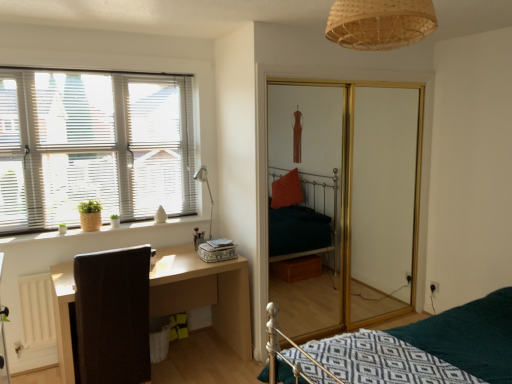
Question: Considering the relative positions of brown leather swivel chair at left and wooden window sill at left in the image provided, is brown leather swivel chair at left behind wooden window sill at left?

Choices:
 (A) yes
 (B) no

Answer: (B)

Question: Can you confirm if brown leather swivel chair at left is wider than wooden window sill at left?

Choices:
 (A) yes
 (B) no

Answer: (A)

Question: Is brown leather swivel chair at left shorter than wooden window sill at left?

Choices:
 (A) yes
 (B) no

Answer: (B)

Question: Is brown leather swivel chair at left bigger than wooden window sill at left?

Choices:
 (A) yes
 (B) no

Answer: (A)

Question: Considering the relative sizes of brown leather swivel chair at left and wooden window sill at left in the image provided, is brown leather swivel chair at left smaller than wooden window sill at left?

Choices:
 (A) yes
 (B) no

Answer: (B)

Question: In the image, is light wood/dark brown desk at lower left positioned in front of or behind gold-framed glass screen door at center?

Choices:
 (A) behind
 (B) front

Answer: (B)

Question: From a real-world perspective, is light wood/dark brown desk at lower left positioned above or below gold-framed glass screen door at center?

Choices:
 (A) above
 (B) below

Answer: (B)

Question: Do you think light wood/dark brown desk at lower left is within gold-framed glass screen door at center, or outside of it?

Choices:
 (A) inside
 (B) outside

Answer: (B)

Question: Looking at the image, does light wood/dark brown desk at lower left seem bigger or smaller compared to gold-framed glass screen door at center?

Choices:
 (A) big
 (B) small

Answer: (B)

Question: Which is correct: white blinds at left is inside light wood/dark brown desk at lower left, or outside of it?

Choices:
 (A) outside
 (B) inside

Answer: (A)

Question: Considering the positions of white blinds at left and light wood/dark brown desk at lower left in the image, is white blinds at left wider or thinner than light wood/dark brown desk at lower left?

Choices:
 (A) wide
 (B) thin

Answer: (B)

Question: In terms of size, does white blinds at left appear bigger or smaller than light wood/dark brown desk at lower left?

Choices:
 (A) big
 (B) small

Answer: (B)

Question: In the image, is white blinds at left on the left side or the right side of light wood/dark brown desk at lower left?

Choices:
 (A) left
 (B) right

Answer: (A)

Question: In the image, is woven bamboo light fixture at upper center positioned in front of or behind gold-framed glass screen door at center?

Choices:
 (A) front
 (B) behind

Answer: (A)

Question: From the image's perspective, is woven bamboo light fixture at upper center positioned above or below gold-framed glass screen door at center?

Choices:
 (A) below
 (B) above

Answer: (B)